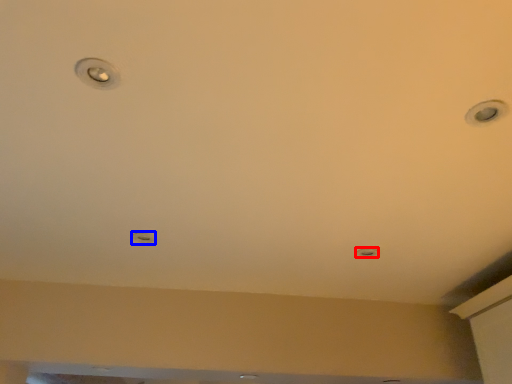
Question: Which object appears farthest to the camera in this image, light (highlighted by a red box) or droplight (highlighted by a blue box)?

Choices:
 (A) light
 (B) droplight

Answer: (A)